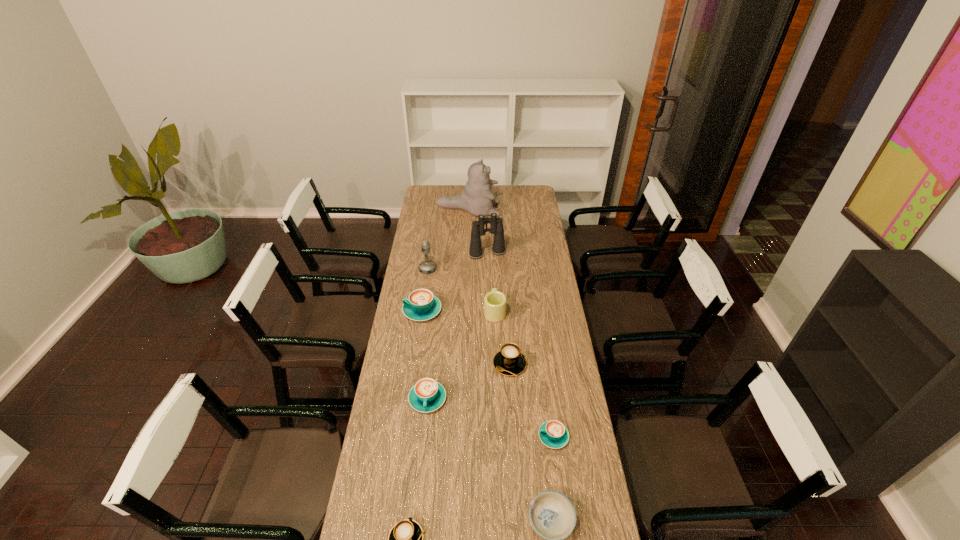
Identify the location of free spot between the second nearest turquoise cappuccino and the mug. The image size is (960, 540). (461, 355).

The height and width of the screenshot is (540, 960). Find the location of `object that ranks as the closest to the biggest turquoise cappuccino`. object that ranks as the closest to the biggest turquoise cappuccino is located at coordinates (427, 266).

This screenshot has height=540, width=960. Identify the location of the third closest object to the ninth shortest object. (494, 302).

Identify which cappuccino is the fourth nearest to the second nearest turquoise cappuccino. Please provide its 2D coordinates. Your answer should be formatted as a tuple, i.e. [(x, y)], where the tuple contains the x and y coordinates of a point satisfying the conditions above.

[(405, 539)]

Locate which cappuccino ranks in proximity to the ninth nearest object. Please provide its 2D coordinates. Your answer should be formatted as a tuple, i.e. [(x, y)], where the tuple contains the x and y coordinates of a point satisfying the conditions above.

[(421, 305)]

Where is `turquoise cappuccino that is the nearest to the second tallest object`? The height and width of the screenshot is (540, 960). turquoise cappuccino that is the nearest to the second tallest object is located at coordinates (421, 305).

Locate which turquoise cappuccino ranks second in proximity to the nearest turquoise cappuccino. Please provide its 2D coordinates. Your answer should be formatted as a tuple, i.e. [(x, y)], where the tuple contains the x and y coordinates of a point satisfying the conditions above.

[(421, 305)]

Locate an element on the screen. vacant space that satisfies the following two spatial constraints: 1. with the handle on the side of the mug; 2. on the face of the cat is located at coordinates (492, 210).

This screenshot has width=960, height=540. Identify the location of free spot that satisfies the following two spatial constraints: 1. with the handle on the side of the fourth tallest object; 2. on the face of the farthest object. (492, 210).

Where is `free space that satisfies the following two spatial constraints: 1. on the face of the farthest object; 2. with the handle on the right side of the third nearest cappuccino`? This screenshot has width=960, height=540. free space that satisfies the following two spatial constraints: 1. on the face of the farthest object; 2. with the handle on the right side of the third nearest cappuccino is located at coordinates (462, 399).